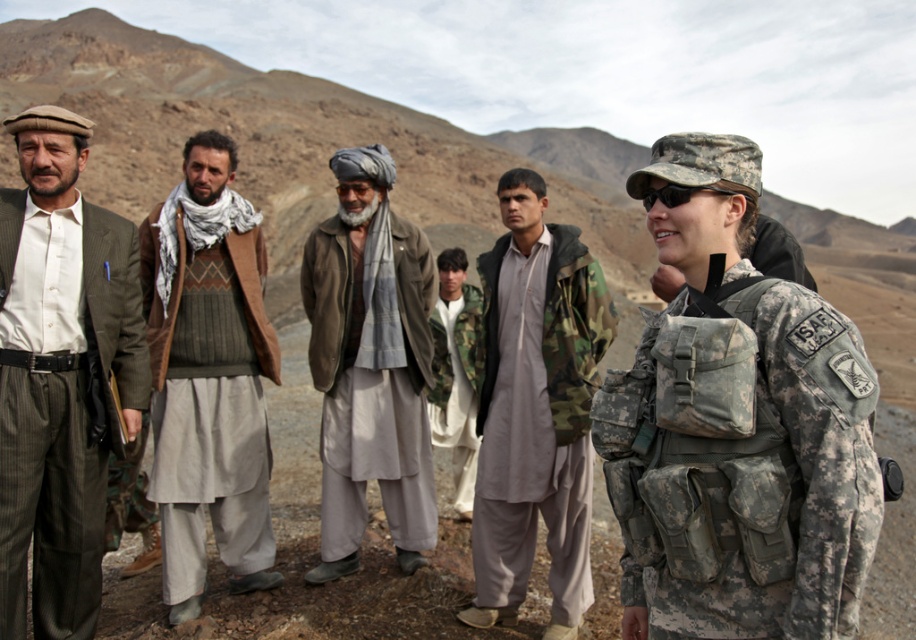
Question: Is gray woolen jacket at center to the right of camouflage fabric backpack at right from the viewer's perspective?

Choices:
 (A) no
 (B) yes

Answer: (A)

Question: Observing the image, what is the correct spatial positioning of camouflage jacket at center in reference to camouflage fabric jacket at center?

Choices:
 (A) below
 (B) above

Answer: (B)

Question: Which object appears closest to the camera in this image?

Choices:
 (A) gray woolen jacket at center
 (B) camouflage fabric backpack at right
 (C) white shirt at center

Answer: (B)

Question: Which object is positioned farthest from the camouflage jacket at center?

Choices:
 (A) knitted wool sweater at center
 (B) camouflage fabric backpack at right
 (C) gray woolen jacket at center
 (D) camouflage fabric jacket at center

Answer: (B)

Question: Based on their relative distances, which object is farther from the white shirt at center?

Choices:
 (A) camouflage fabric jacket at center
 (B) camouflage jacket at center

Answer: (A)

Question: Is white shirt at center wider than camouflage fabric backpack at right?

Choices:
 (A) yes
 (B) no

Answer: (A)